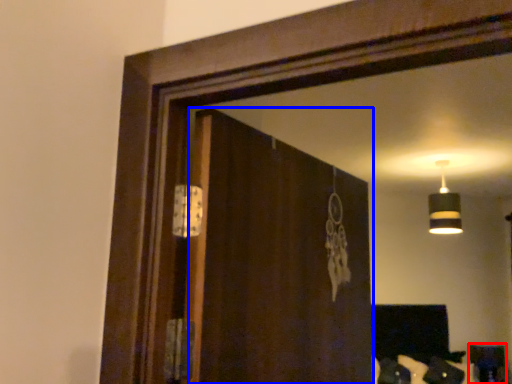
Question: Which object is closer to the camera taking this photo, furniture (highlighted by a red box) or screen door (highlighted by a blue box)?

Choices:
 (A) furniture
 (B) screen door

Answer: (B)